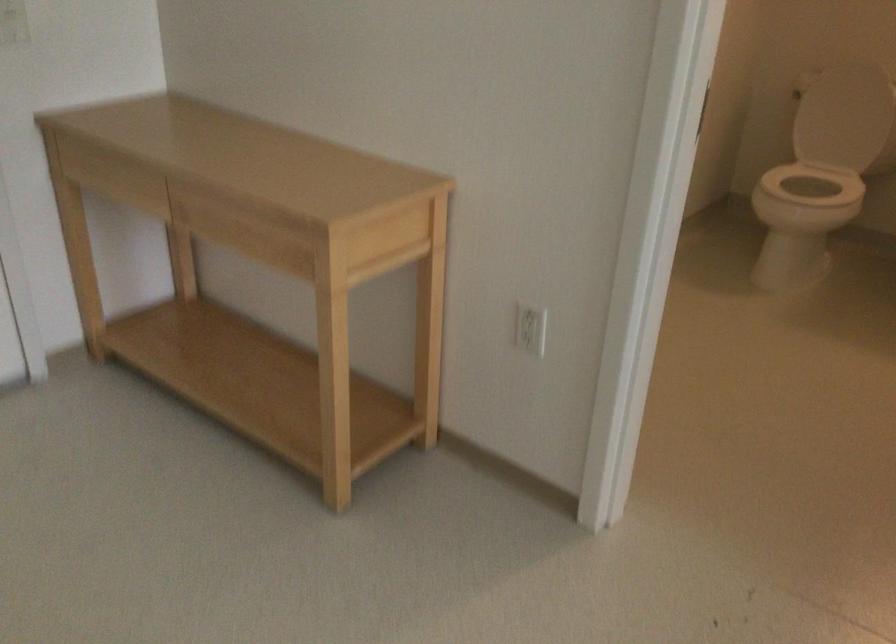
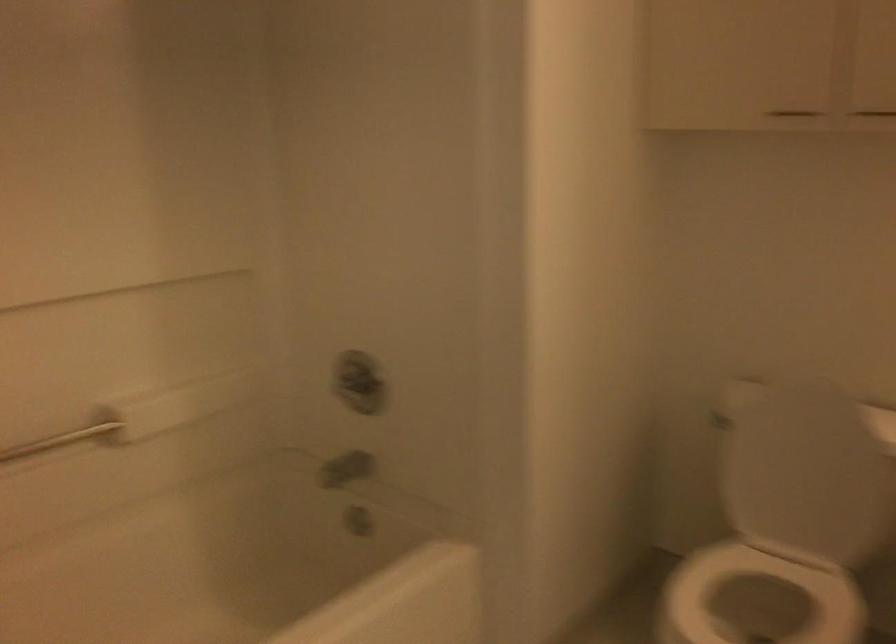
In a continuous first-person perspective shot, in which direction is the camera moving?

The movement direction of the cameraman is right, forward.